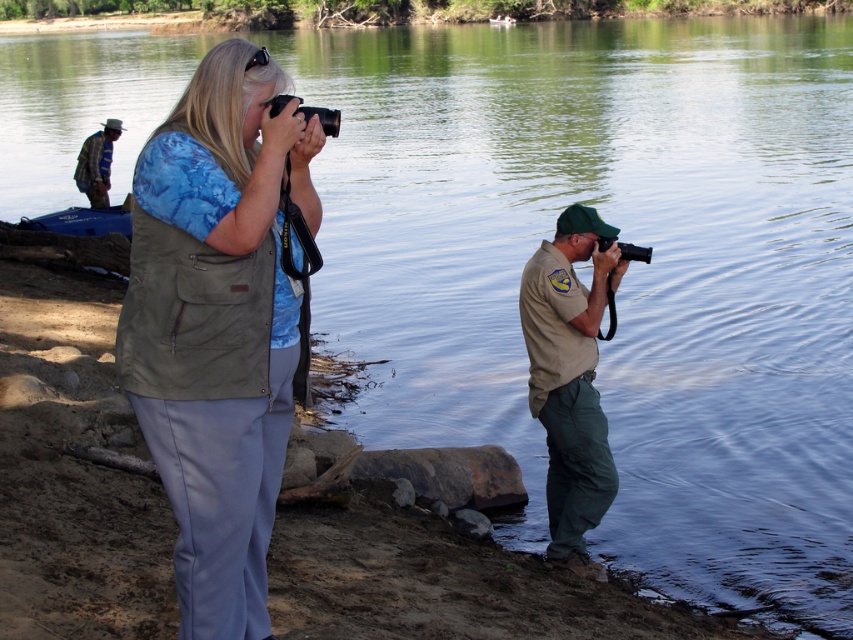
Based on the photo, you are a photographer trying to decide which subject to focus on first. The matte khaki vest at center and the khaki uniform at right are both in your frame. Based on their sizes, which one should you prioritize to ensure it appears larger in your photo?

The khaki uniform at right is taller than the matte khaki vest at center, so you should prioritize photographing the khaki uniform at right first to ensure it appears larger in your photo.

Consider the image. You are a photographer trying to determine which khaki item is closer to you. You see the matte khaki vest at center and the khaki uniform at right. Which one is closer?

The matte khaki vest at center is closer because it is positioned over the khaki uniform at right.

Based on the scene description, can you determine which object is placed lower in the image between the matte khaki vest at center and the striped fabric shirt at upper left?

The matte khaki vest at center is positioned under the striped fabric shirt at upper left, so the matte khaki vest at center is lower in the image.